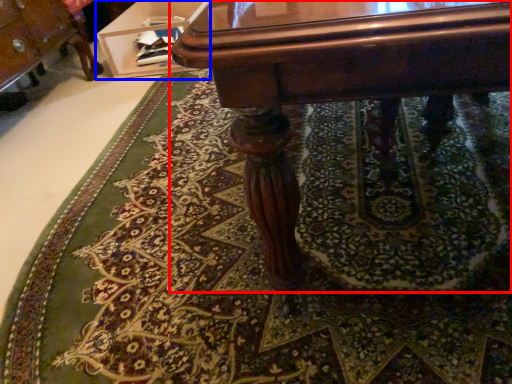
Question: Which object appears farthest to the camera in this image, table (highlighted by a red box) or vanity (highlighted by a blue box)?

Choices:
 (A) table
 (B) vanity

Answer: (B)